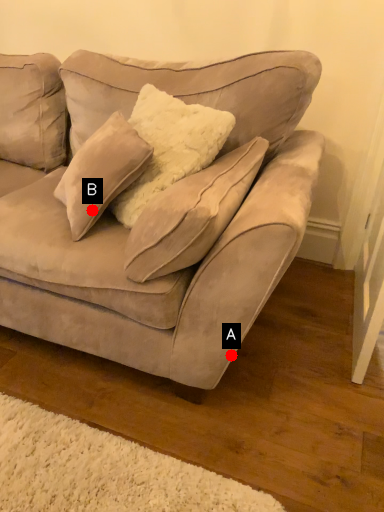
Question: Two points are circled on the image, labeled by A and B beside each circle. Which point is further to the camera?

Choices:
 (A) A is further
 (B) B is further

Answer: (B)